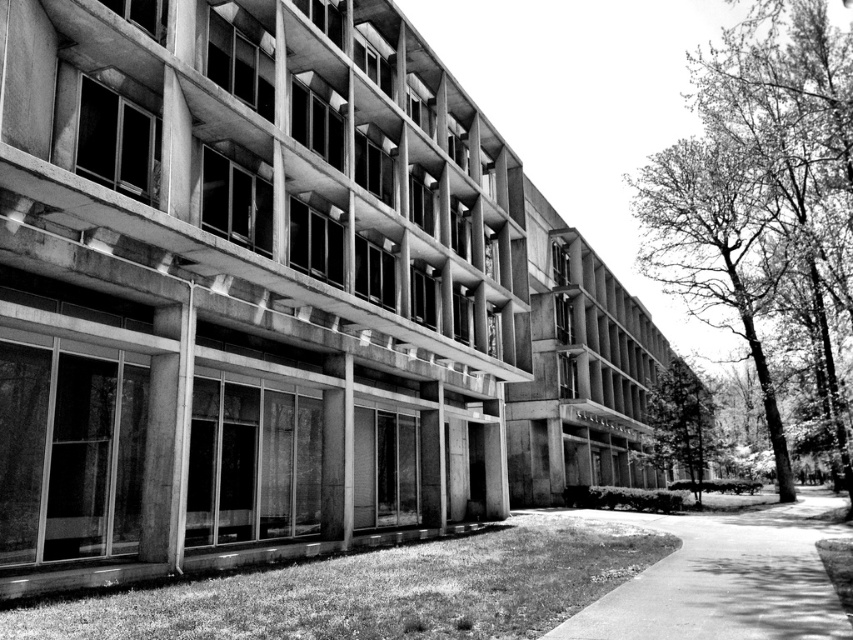
Who is more distant from viewer, [776,237] or [653,465]?

Positioned behind is point [776,237].

Is smooth bark tree at right taller than green leafy tree at center?

Indeed, smooth bark tree at right has a greater height compared to green leafy tree at center.

Find the location of a particular element. The height and width of the screenshot is (640, 853). smooth bark tree at right is located at coordinates (755, 188).

Which of these two, smooth bark tree at right or smooth concrete path at center, stands taller?

smooth bark tree at right is taller.

Looking at this image, is smooth bark tree at right closer to camera compared to smooth concrete path at center?

That is False.

The height and width of the screenshot is (640, 853). Describe the element at coordinates (755, 188) in the screenshot. I see `smooth bark tree at right` at that location.

Where is `smooth bark tree at right`? The image size is (853, 640). smooth bark tree at right is located at coordinates (755, 188).

Which of these two, smooth concrete path at center or green leafy tree at center, stands shorter?

smooth concrete path at center is shorter.

The height and width of the screenshot is (640, 853). Describe the element at coordinates (723, 579) in the screenshot. I see `smooth concrete path at center` at that location.

Find the location of a particular element. smooth concrete path at center is located at coordinates (723, 579).